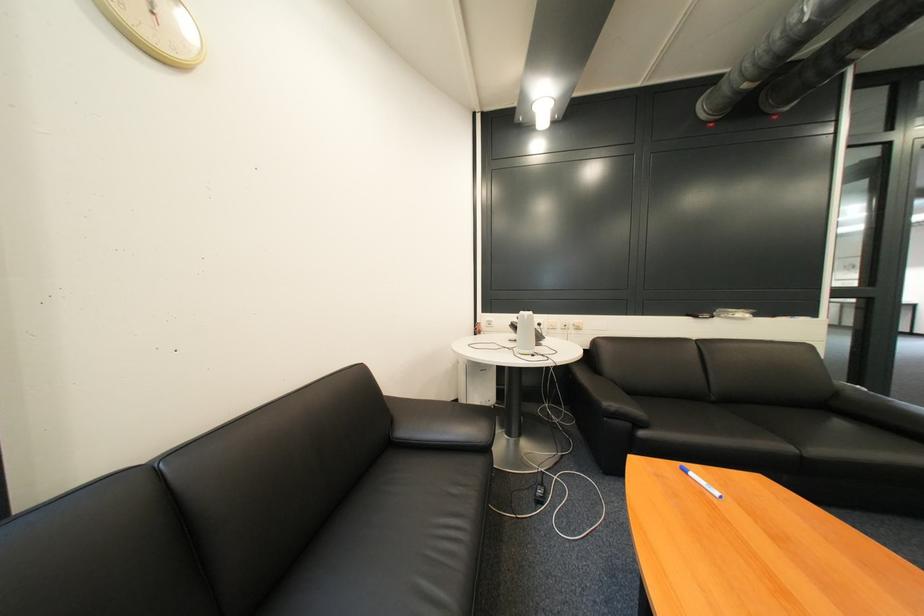
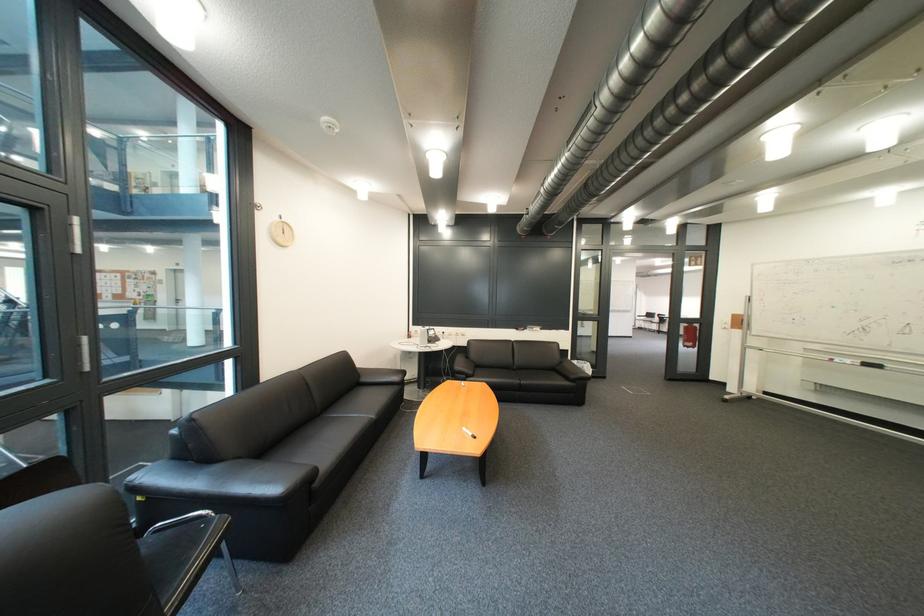
In the second image, find the point that corresponds to the point at 496,313 in the first image.

(428, 326)